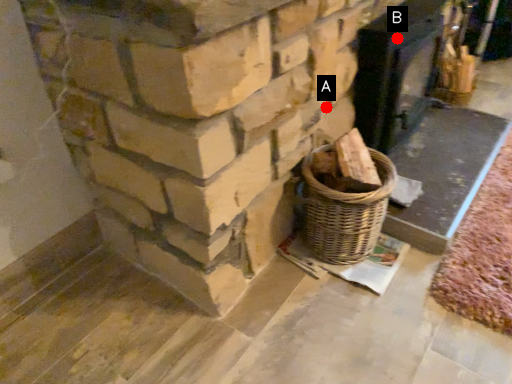
Question: Two points are circled on the image, labeled by A and B beside each circle. Among these points, which one is nearest to the camera?

Choices:
 (A) A is closer
 (B) B is closer

Answer: (A)